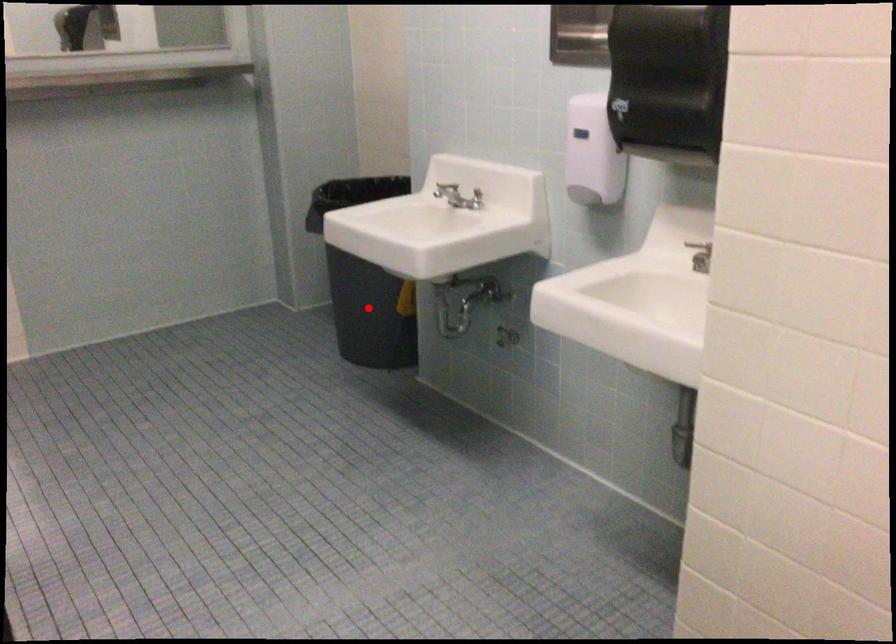
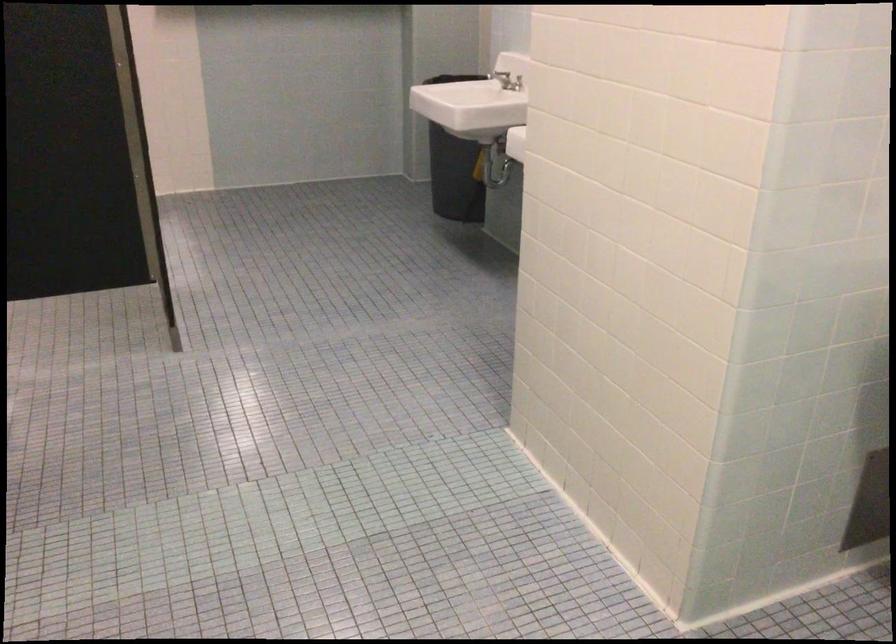
In the second image, find the point that corresponds to the highlighted location in the first image.

(453, 167)